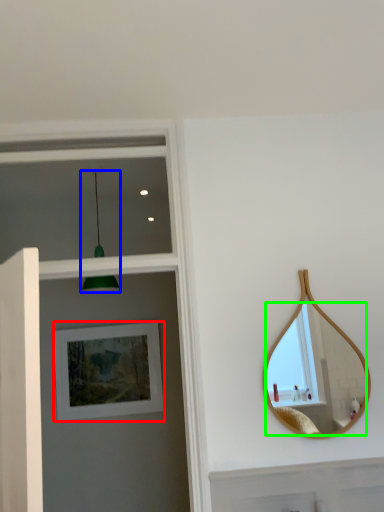
Question: Estimate the real-world distances between objects in this image. Which object is closer to picture frame (highlighted by a red box), light fixture (highlighted by a blue box) or mirror (highlighted by a green box)?

Choices:
 (A) light fixture
 (B) mirror

Answer: (A)